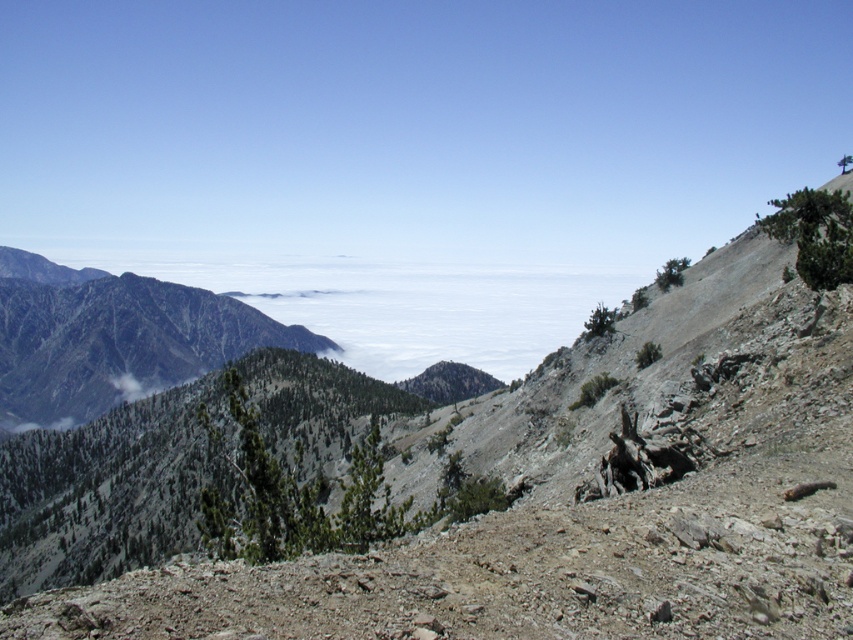
Can you confirm if dull gray rock at center is bigger than green textured mountain at left?

Incorrect, dull gray rock at center is not larger than green textured mountain at left.

How far apart are dull gray rock at center and green textured mountain at left?

dull gray rock at center and green textured mountain at left are 462.21 meters apart.

Between point (813, 605) and point (248, 314), which one is positioned in front?

Point (813, 605)

Identify the location of dull gray rock at center. Image resolution: width=853 pixels, height=640 pixels. (583, 502).